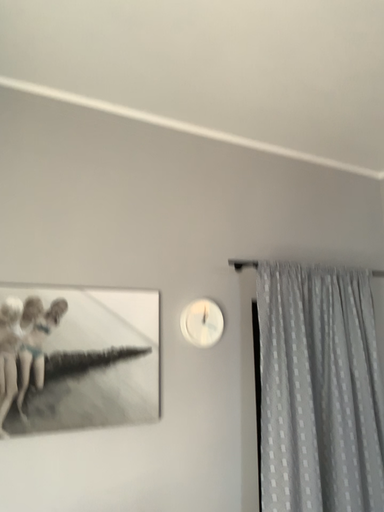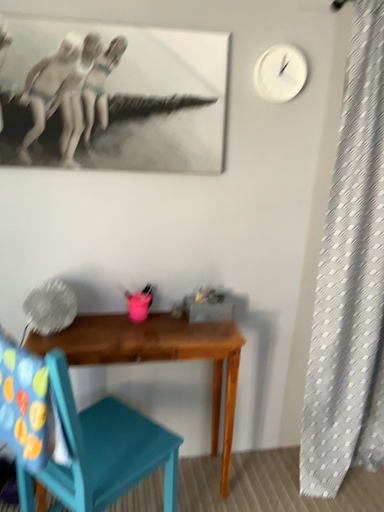
Question: Which way did the camera rotate in the video?

Choices:
 (A) rotated upward
 (B) rotated downward

Answer: (B)